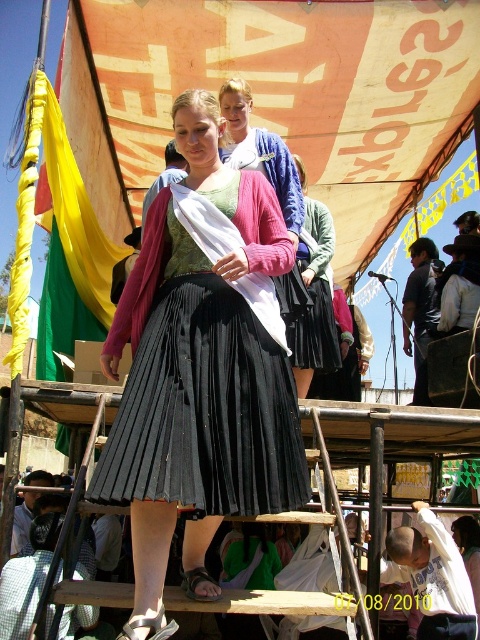
You are organizing a photo shoot and need to position two models wearing the black pleated skirt at center and the matte black skirt at center. Given the space available, can you place them 30 feet apart?

The distance between the black pleated skirt at center and matte black skirt at center is 31.24 feet, so yes, you can place them 30 feet apart as the existing distance is greater than the required separation.

Looking at this image, you are a photographer taking a picture of the matte pink sweater at center and the matte black skirt at center. Which one should you focus on first if you want to capture both in sharp detail?

The matte pink sweater at center is above the matte black skirt at center, so you should focus on the matte black skirt at center first as it is closer to the camera.